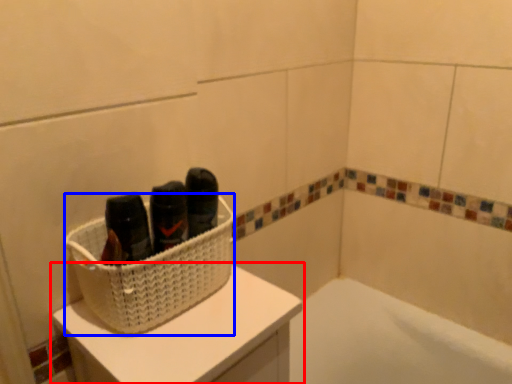
Question: Among these objects, which one is nearest to the camera, furniture (highlighted by a red box) or basket (highlighted by a blue box)?

Choices:
 (A) furniture
 (B) basket

Answer: (A)